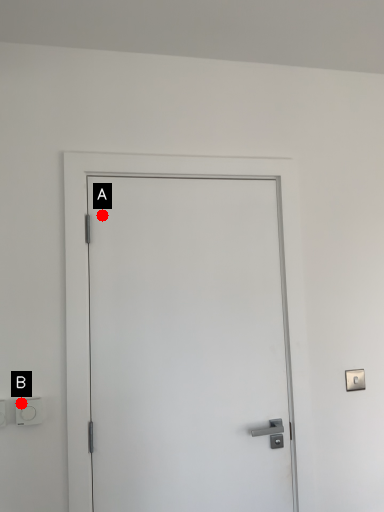
Question: Two points are circled on the image, labeled by A and B beside each circle. Which point is closer to the camera?

Choices:
 (A) A is closer
 (B) B is closer

Answer: (B)